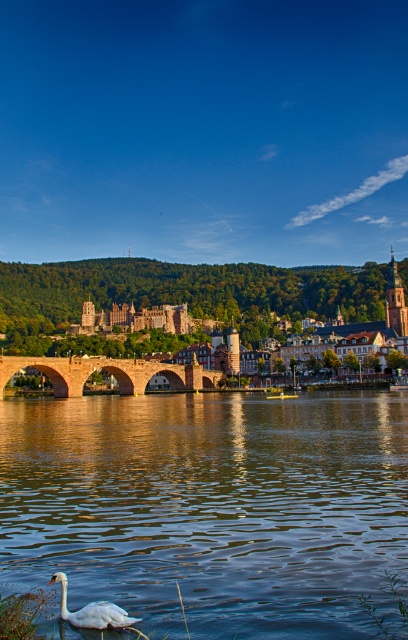
You are a tourist standing at the riverside and want to take a photo of the white glossy swan at lower left and the brown stone bridge at center. From your current position, which object is closer to the left side of your view?

The white glossy swan at lower left is closer to the left side of your view because the brown stone bridge at center is to the right of it.